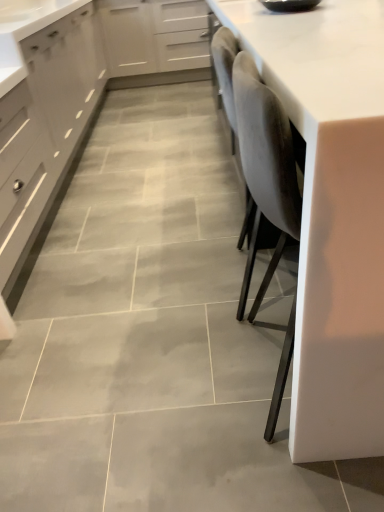
Question: Does matte gray cabinet at left, which ranks as the 1th cabinetry in left-to-right order, have a lesser height compared to white glossy countertop at right?

Choices:
 (A) no
 (B) yes

Answer: (B)

Question: Is matte gray cabinet at left, which ranks as the 1th cabinetry in left-to-right order, outside of white glossy countertop at right?

Choices:
 (A) no
 (B) yes

Answer: (B)

Question: Is matte gray cabinet at left, which ranks as the 1th cabinetry in left-to-right order, behind white glossy countertop at right?

Choices:
 (A) yes
 (B) no

Answer: (A)

Question: Considering the relative positions of matte gray cabinet at left, acting as the second cabinetry starting from the right, and white glossy countertop at right in the image provided, is matte gray cabinet at left, acting as the second cabinetry starting from the right, to the right of white glossy countertop at right from the viewer's perspective?

Choices:
 (A) no
 (B) yes

Answer: (A)

Question: Does matte gray cabinet at left, acting as the second cabinetry starting from the right, have a greater width compared to white glossy countertop at right?

Choices:
 (A) yes
 (B) no

Answer: (B)

Question: Is matte gray cabinet at left, acting as the second cabinetry starting from the right, closer to the viewer compared to white glossy countertop at right?

Choices:
 (A) no
 (B) yes

Answer: (A)

Question: From the image's perspective, is matte gray drawer at left located above matte gray cabinet at left, which ranks as the 1th cabinetry in left-to-right order?

Choices:
 (A) yes
 (B) no

Answer: (B)

Question: Are matte gray drawer at left and matte gray cabinet at left, acting as the second cabinetry starting from the right, located far from each other?

Choices:
 (A) no
 (B) yes

Answer: (A)

Question: Considering the relative sizes of matte gray drawer at left and matte gray cabinet at left, which ranks as the 1th cabinetry in left-to-right order, in the image provided, is matte gray drawer at left thinner than matte gray cabinet at left, which ranks as the 1th cabinetry in left-to-right order,?

Choices:
 (A) no
 (B) yes

Answer: (B)

Question: Does matte gray drawer at left have a greater width compared to matte gray cabinet at left, which ranks as the 1th cabinetry in left-to-right order?

Choices:
 (A) no
 (B) yes

Answer: (A)

Question: Is matte gray drawer at left looking in the opposite direction of matte gray cabinet at left, acting as the second cabinetry starting from the right?

Choices:
 (A) yes
 (B) no

Answer: (B)

Question: Does matte gray drawer at left turn towards matte gray cabinet at left, which ranks as the 1th cabinetry in left-to-right order?

Choices:
 (A) no
 (B) yes

Answer: (A)

Question: Is white glossy countertop at right outside of matte gray cabinet at left, which ranks as the 1th cabinetry in left-to-right order?

Choices:
 (A) yes
 (B) no

Answer: (A)